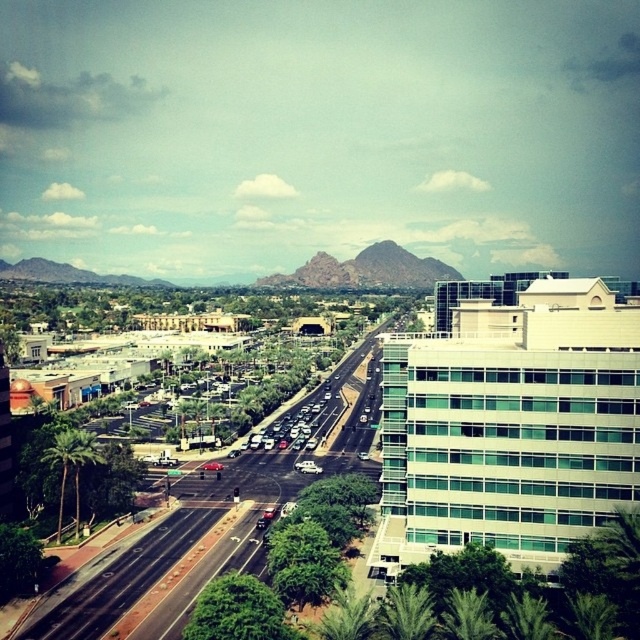
Question: Which is nearer to the green leafy palm tree at lower left?

Choices:
 (A) green leafy palm tree at lower right
 (B) green leafy palm tree at lower center

Answer: (B)

Question: Where is dark asphalt highway at center located in relation to green leafy palm tree at lower right in the image?

Choices:
 (A) right
 (B) left

Answer: (B)

Question: Which object is closer to the camera taking this photo?

Choices:
 (A) rugged rock formation at center
 (B) green leafy palm tree at lower left
 (C) green leafy palm tree at lower right
 (D) dark asphalt highway at center

Answer: (C)

Question: Which point appears closest to the camera in this image?

Choices:
 (A) (276, 477)
 (B) (276, 284)
 (C) (65, 445)
 (D) (467, 625)

Answer: (D)

Question: Does dark asphalt highway at center appear over green leafy palm tree at lower left?

Choices:
 (A) yes
 (B) no

Answer: (B)

Question: Can you confirm if dark asphalt highway at center is smaller than green leafy palm tree at lower right?

Choices:
 (A) no
 (B) yes

Answer: (A)